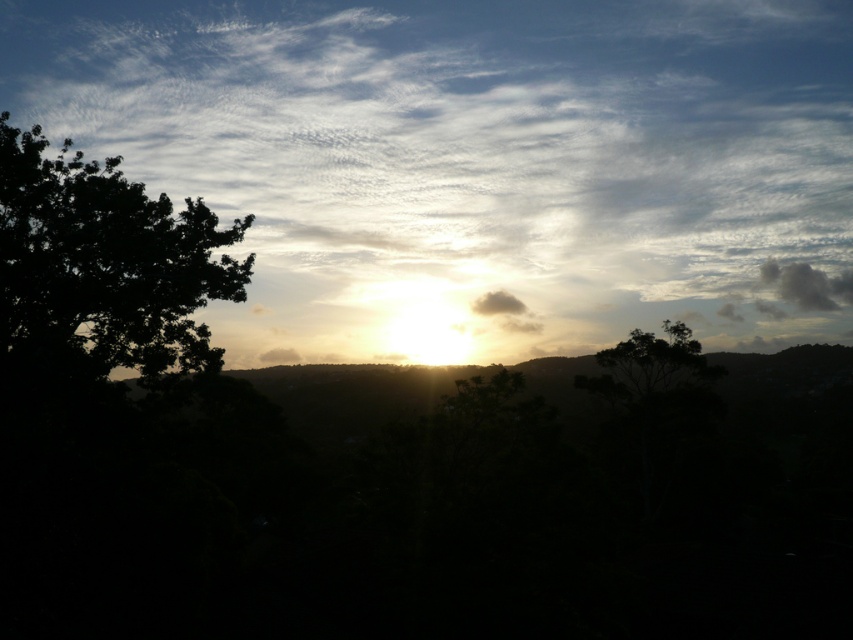
How much distance is there between dark green leafy tree at center and gray fluffy cloud at upper right?

They are 166.29 meters apart.

Is dark green leafy tree at center thinner than gray fluffy cloud at upper right?

Indeed, dark green leafy tree at center has a lesser width compared to gray fluffy cloud at upper right.

Describe the element at coordinates (650, 365) in the screenshot. Image resolution: width=853 pixels, height=640 pixels. I see `dark green leafy tree at center` at that location.

At what (x,y) coordinates should I click in order to perform the action: click on dark green leafy tree at center. Please return your answer as a coordinate pair (x, y). This screenshot has height=640, width=853. Looking at the image, I should click on (650, 365).

Can you confirm if white fluffy cloud at upper center is smaller than dark leafy tree at left?

Actually, white fluffy cloud at upper center might be larger than dark leafy tree at left.

In the scene shown: Who is positioned more to the right, white fluffy cloud at upper center or dark leafy tree at left?

From the viewer's perspective, white fluffy cloud at upper center appears more on the right side.

This screenshot has width=853, height=640. Find the location of `white fluffy cloud at upper center`. white fluffy cloud at upper center is located at coordinates (473, 163).

Does white fluffy cloud at upper center appear on the left side of dark green leafy tree at center?

Yes, white fluffy cloud at upper center is to the left of dark green leafy tree at center.

Who is positioned more to the left, white fluffy cloud at upper center or dark green leafy tree at center?

Positioned to the left is white fluffy cloud at upper center.

Between point (584, 216) and point (711, 376), which one is positioned in front?

Point (711, 376) is more forward.

This screenshot has width=853, height=640. Identify the location of white fluffy cloud at upper center. (473, 163).